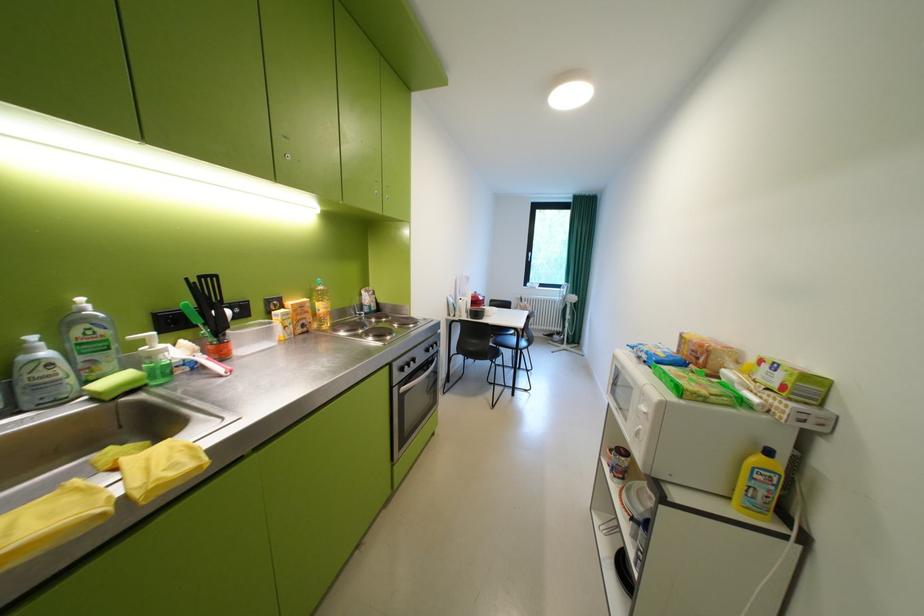
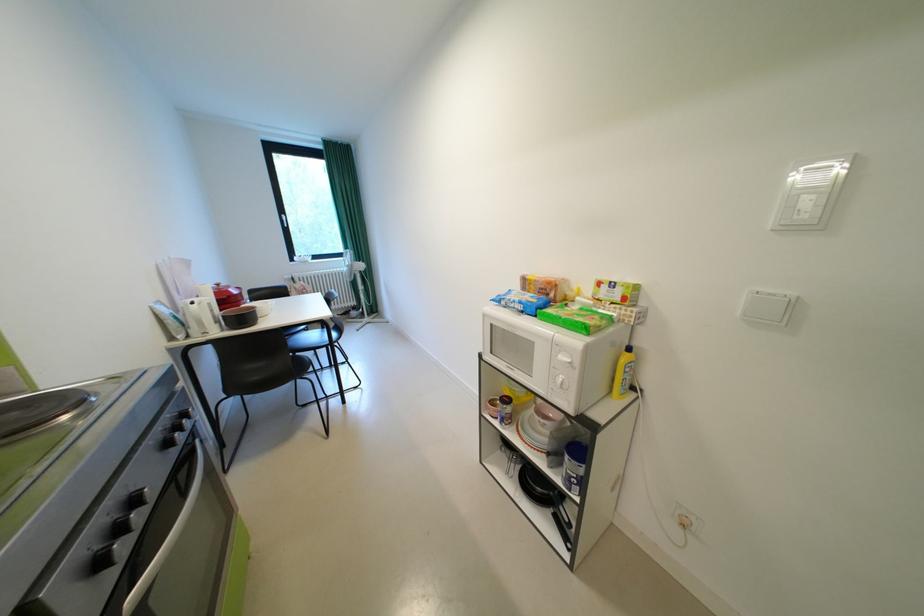
Locate, in the second image, the point that corresponds to point 411,370 in the first image.

(108, 565)